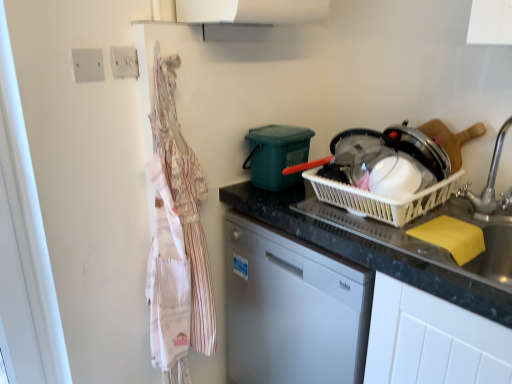
What do you see at coordinates (124, 62) in the screenshot? The height and width of the screenshot is (384, 512). I see `white plastic electric outlet at upper left, the first electric outlet viewed from the back` at bounding box center [124, 62].

Locate an element on the screen. Image resolution: width=512 pixels, height=384 pixels. white plastic electric outlet at upper left, the 2th electric outlet when ordered from right to left is located at coordinates (87, 65).

This screenshot has height=384, width=512. Describe the element at coordinates (381, 199) in the screenshot. I see `white plastic basket at center` at that location.

Where is `striped cotton apron at left`? striped cotton apron at left is located at coordinates (177, 240).

Considering the relative sizes of striped cotton apron at left and white plastic basket at center in the image provided, is striped cotton apron at left bigger than white plastic basket at center?

Indeed, striped cotton apron at left has a larger size compared to white plastic basket at center.

There is a striped cotton apron at left. Where is `basket above it (from a real-world perspective)`? The image size is (512, 384). basket above it (from a real-world perspective) is located at coordinates (381, 199).

Which is in front, point (158, 239) or point (333, 200)?

The point (158, 239) is closer to the camera.

Is striped cotton apron at left situated inside white plastic basket at center or outside?

striped cotton apron at left exists outside the volume of white plastic basket at center.

Is point (477, 209) farther from camera compared to point (412, 278)?

Yes, it is.

The image size is (512, 384). Identify the location of countertop on the left of silver metallic faucet at right. (368, 251).

Is silver metallic faucet at right in front of or behind black granite countertop at center in the image?

silver metallic faucet at right is in front of black granite countertop at center.

Does silver metallic faucet at right have a lesser height compared to black granite countertop at center?

Correct, silver metallic faucet at right is not as tall as black granite countertop at center.

Are white plastic electric outlet at upper left, which is counted as the first electric outlet, starting from the left, and yellow sponge at sink far apart?

Absolutely, white plastic electric outlet at upper left, which is counted as the first electric outlet, starting from the left, is distant from yellow sponge at sink.

You are a GUI agent. You are given a task and a screenshot of the screen. Output one action in this format:
    pyautogui.click(x=<x>, y=<y>)
    Task: Click on the 2nd electric outlet to the left when counting from the yellow sponge at sink
    
    Given the screenshot: What is the action you would take?
    pyautogui.click(x=87, y=65)

Do you think white plastic electric outlet at upper left, which is counted as the first electric outlet, starting from the left, is within yellow sponge at sink, or outside of it?

white plastic electric outlet at upper left, which is counted as the first electric outlet, starting from the left, is outside yellow sponge at sink.

Does white plastic electric outlet at upper left, the 1th electric outlet from the front, lie in front of yellow sponge at sink?

No, white plastic electric outlet at upper left, the 1th electric outlet from the front, is further to the viewer.

Is white plastic basket at center taller or shorter than yellow sponge at sink?

Considering their sizes, white plastic basket at center has less height than yellow sponge at sink.

From a real-world perspective, is white plastic basket at center physically above yellow sponge at sink?

Correct, in the physical world, white plastic basket at center is higher than yellow sponge at sink.

Considering the relative sizes of white plastic basket at center and yellow sponge at sink in the image provided, is white plastic basket at center thinner than yellow sponge at sink?

Yes.

Is black granite countertop at center smaller than white plastic electric outlet at upper left, which is counted as the first electric outlet, starting from the left?

Actually, black granite countertop at center might be larger than white plastic electric outlet at upper left, which is counted as the first electric outlet, starting from the left.

Would you say black granite countertop at center is inside or outside white plastic electric outlet at upper left, which is the second electric outlet from back to front?

black granite countertop at center exists outside the volume of white plastic electric outlet at upper left, which is the second electric outlet from back to front.

In the scene shown: Is black granite countertop at center far away from white plastic electric outlet at upper left, which is counted as the first electric outlet, starting from the left?

No, black granite countertop at center is not far away from white plastic electric outlet at upper left, which is counted as the first electric outlet, starting from the left.

Is striped cotton apron at left next to white plastic electric outlet at upper left, which is counted as the first electric outlet, starting from the left, and touching it?

→ No, striped cotton apron at left is not beside white plastic electric outlet at upper left, which is counted as the first electric outlet, starting from the left.

Considering their positions, is striped cotton apron at left located in front of or behind white plastic electric outlet at upper left, the 1th electric outlet from the front?

Visually, striped cotton apron at left is located in front of white plastic electric outlet at upper left, the 1th electric outlet from the front.

From a real-world perspective, between striped cotton apron at left and white plastic electric outlet at upper left, which is counted as the first electric outlet, starting from the left, who is vertically higher?

In real-world perspective, white plastic electric outlet at upper left, which is counted as the first electric outlet, starting from the left, is above.

Is striped cotton apron at left turned away from white plastic electric outlet at upper left, which is counted as the first electric outlet, starting from the left?

No, striped cotton apron at left is not facing the opposite direction of white plastic electric outlet at upper left, which is counted as the first electric outlet, starting from the left.

Is white plastic basket at center next to silver metallic faucet at right?

white plastic basket at center and silver metallic faucet at right are clearly separated.

From a real-world perspective, is white plastic basket at center on silver metallic faucet at right?

Incorrect, from a real-world perspective, white plastic basket at center is lower than silver metallic faucet at right.

Which object is wider, white plastic basket at center or silver metallic faucet at right?

Wider between the two is white plastic basket at center.

What are the coordinates of `basket behind the striped cotton apron at left` in the screenshot? It's located at (381, 199).

Locate an element on the screen. The width and height of the screenshot is (512, 384). faucet above the black granite countertop at center (from a real-world perspective) is located at coordinates (489, 178).

Which object lies nearer to the anchor point yellow sponge at sink, white plastic electric outlet at upper left, which is the second electric outlet in left-to-right order, or black granite countertop at center?

Among the two, black granite countertop at center is located nearer to yellow sponge at sink.

Considering their positions, is striped cotton apron at left positioned closer to white plastic electric outlet at upper left, the 2th electric outlet when ordered from right to left, than silver metallic faucet at right?

striped cotton apron at left.

Based on the photo, based on their spatial positions, is striped cotton apron at left or silver metallic faucet at right closer to white plastic basket at center?

silver metallic faucet at right is positioned closer to the anchor white plastic basket at center.

When comparing their distances from white plastic electric outlet at upper left, the 1th electric outlet from the front, does striped cotton apron at left or black granite countertop at center seem closer?

Based on the image, striped cotton apron at left appears to be nearer to white plastic electric outlet at upper left, the 1th electric outlet from the front.

Estimate the real-world distances between objects in this image. Which object is closer to silver metallic faucet at right, striped cotton apron at left or black granite countertop at center?

black granite countertop at center.

Based on their spatial positions, is white plastic basket at center or striped cotton apron at left further from white plastic electric outlet at upper left, which is counted as the first electric outlet, starting from the left?

Based on the image, white plastic basket at center appears to be further to white plastic electric outlet at upper left, which is counted as the first electric outlet, starting from the left.

Estimate the real-world distances between objects in this image. Which object is closer to black granite countertop at center, white plastic electric outlet at upper left, the first electric outlet viewed from the back, or white plastic electric outlet at upper left, which is the second electric outlet from back to front?

Among the two, white plastic electric outlet at upper left, the first electric outlet viewed from the back, is located nearer to black granite countertop at center.

When comparing their distances from white plastic electric outlet at upper left, which is the second electric outlet in left-to-right order, does yellow sponge at sink or white plastic basket at center seem closer?

Based on the image, white plastic basket at center appears to be nearer to white plastic electric outlet at upper left, which is the second electric outlet in left-to-right order.

Locate an element on the screen. This screenshot has width=512, height=384. laundry between white plastic electric outlet at upper left, the 2th electric outlet when ordered from right to left, and black granite countertop at center, in the vertical direction is located at coordinates (177, 240).

Locate an element on the screen. basket between white plastic electric outlet at upper left, the second electric outlet when ordered from front to back, and silver metallic faucet at right is located at coordinates (381, 199).

The width and height of the screenshot is (512, 384). In order to click on electric outlet between white plastic electric outlet at upper left, the 1th electric outlet from the front, and yellow sponge at sink, in the horizontal direction in this screenshot , I will do `click(124, 62)`.

I want to click on laundry between white plastic electric outlet at upper left, the first electric outlet viewed from the back, and silver metallic faucet at right, so click(177, 240).